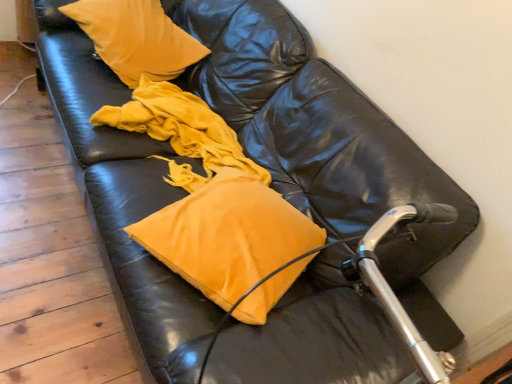
Question: From the image's perspective, is velvet yellow pillow at upper left, placed as the 2th pillow when sorted from bottom to top, located above or below matte yellow pillow at center, acting as the first pillow starting from the front?

Choices:
 (A) below
 (B) above

Answer: (B)

Question: Relative to matte yellow pillow at center, positioned as the second pillow in back-to-front order, is velvet yellow pillow at upper left, the 1th pillow in the back-to-front sequence, in front or behind?

Choices:
 (A) front
 (B) behind

Answer: (B)

Question: Considering the real-world distances, which object is farthest from the velvet yellow pillow at upper left, marked as the 2th pillow in a front-to-back arrangement?

Choices:
 (A) matte yellow pillow at center
 (B) matte yellow pillow at center, positioned as the second pillow in back-to-front order

Answer: (B)

Question: Which of these objects is positioned closest to the velvet yellow pillow at upper left, placed as the 2th pillow when sorted from bottom to top?

Choices:
 (A) matte yellow pillow at center, the 1th pillow positioned from the bottom
 (B) matte yellow pillow at center

Answer: (B)